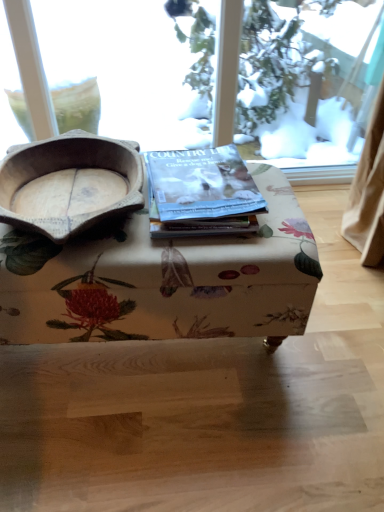
Image resolution: width=384 pixels, height=512 pixels. What do you see at coordinates (162, 279) in the screenshot?
I see `floral fabric ottoman at center` at bounding box center [162, 279].

Describe the element at coordinates (202, 184) in the screenshot. I see `matte paper magazine at center` at that location.

Image resolution: width=384 pixels, height=512 pixels. I want to click on floral fabric ottoman at center, so click(x=162, y=279).

In the image, there is a matte paper magazine at center. Where is `table below it (from a real-world perspective)`? table below it (from a real-world perspective) is located at coordinates (162, 279).

Considering the relative sizes of matte paper magazine at center and floral fabric ottoman at center in the image provided, is matte paper magazine at center shorter than floral fabric ottoman at center?

Correct, matte paper magazine at center is not as tall as floral fabric ottoman at center.

From the image's perspective, is matte paper magazine at center over floral fabric ottoman at center?

Correct, matte paper magazine at center appears higher than floral fabric ottoman at center in the image.

Between floral fabric ottoman at center and matte paper magazine at center, which one is positioned behind?

matte paper magazine at center is further away from the camera.

Locate an element on the screen. table on the left of matte paper magazine at center is located at coordinates click(x=162, y=279).

Based on the photo, from the image's perspective, is floral fabric ottoman at center beneath matte paper magazine at center?

Yes, from the image's perspective, floral fabric ottoman at center is beneath matte paper magazine at center.

In the scene shown: Is floral fabric ottoman at center inside or outside of matte paper magazine at center?

floral fabric ottoman at center is spatially situated outside matte paper magazine at center.

Between wooden bowl at left and floral fabric ottoman at center, which one has smaller size?

wooden bowl at left is smaller.

Is wooden bowl at left at the right side of floral fabric ottoman at center?

No, wooden bowl at left is not to the right of floral fabric ottoman at center.

Is point (137, 161) farther from camera compared to point (283, 280)?

Yes, it is behind point (283, 280).

Where is `table that is under the wooden bowl at left (from a real-world perspective)`? table that is under the wooden bowl at left (from a real-world perspective) is located at coordinates (162, 279).

Do you think floral fabric ottoman at center is within wooden bowl at left, or outside of it?

floral fabric ottoman at center lies outside wooden bowl at left.

From the image's perspective, is floral fabric ottoman at center located above wooden bowl at left?

No, from the image's perspective, floral fabric ottoman at center is not above wooden bowl at left.

Considering the positions of objects floral fabric ottoman at center and wooden bowl at left in the image provided, who is behind, floral fabric ottoman at center or wooden bowl at left?

floral fabric ottoman at center is further away from the camera.

Is floral fabric ottoman at center aimed at wooden bowl at left?

No, floral fabric ottoman at center is not turned towards wooden bowl at left.

Is wooden bowl at left oriented away from matte paper magazine at center?

wooden bowl at left is not turned away from matte paper magazine at center.

Can you confirm if wooden bowl at left is wider than matte paper magazine at center?

Yes, wooden bowl at left is wider than matte paper magazine at center.

Locate an element on the screen. The image size is (384, 512). bowl that is in front of the matte paper magazine at center is located at coordinates (69, 183).

Which of these two, wooden bowl at left or matte paper magazine at center, stands shorter?

matte paper magazine at center is shorter.

From the image's perspective, which one is positioned lower, matte paper magazine at center or wooden bowl at left?

wooden bowl at left appears lower in the image.

Considering the positions of objects matte paper magazine at center and wooden bowl at left in the image provided, who is more to the left, matte paper magazine at center or wooden bowl at left?

Positioned to the left is wooden bowl at left.

Is matte paper magazine at center far away from wooden bowl at left?

No, matte paper magazine at center is not far away from wooden bowl at left.

Is matte paper magazine at center closer to camera compared to wooden bowl at left?

No, matte paper magazine at center is behind wooden bowl at left.

Locate an element on the screen. This screenshot has width=384, height=512. table below the matte paper magazine at center (from a real-world perspective) is located at coordinates (162, 279).

This screenshot has height=512, width=384. Find the location of `table that appears in front of the matte paper magazine at center`. table that appears in front of the matte paper magazine at center is located at coordinates (162, 279).

Which object lies nearer to the anchor point floral fabric ottoman at center, wooden bowl at left or matte paper magazine at center?

Among the two, matte paper magazine at center is located nearer to floral fabric ottoman at center.

Which object lies further to the anchor point wooden bowl at left, floral fabric ottoman at center or matte paper magazine at center?

Among the two, floral fabric ottoman at center is located further to wooden bowl at left.

From the image, which object appears to be farther from floral fabric ottoman at center, matte paper magazine at center or wooden bowl at left?

wooden bowl at left.

From the image, which object appears to be farther from matte paper magazine at center, wooden bowl at left or floral fabric ottoman at center?

wooden bowl at left is further to matte paper magazine at center.

Considering their positions, is floral fabric ottoman at center positioned further to matte paper magazine at center than wooden bowl at left?

wooden bowl at left is positioned further to the anchor matte paper magazine at center.

Which object lies further to the anchor point wooden bowl at left, matte paper magazine at center or floral fabric ottoman at center?

floral fabric ottoman at center.

This screenshot has width=384, height=512. I want to click on table situated between wooden bowl at left and matte paper magazine at center from left to right, so click(x=162, y=279).